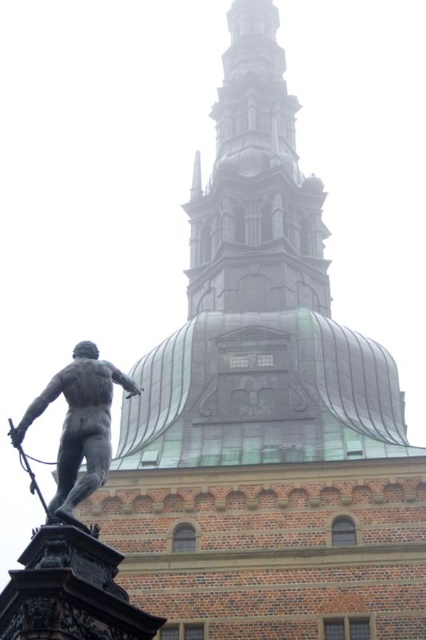
Question: Which point is farther to the camera?

Choices:
 (A) polished bronze statue at center
 (B) green copper dome at upper center

Answer: (B)

Question: Does green copper dome at upper center appear under polished bronze statue at center?

Choices:
 (A) yes
 (B) no

Answer: (B)

Question: Among these objects, which one is nearest to the camera?

Choices:
 (A) polished bronze statue at center
 (B) green copper dome at upper center

Answer: (A)

Question: Can you confirm if green copper dome at upper center is positioned above polished bronze statue at center?

Choices:
 (A) yes
 (B) no

Answer: (A)

Question: Does green copper dome at upper center have a greater width compared to polished bronze statue at center?

Choices:
 (A) no
 (B) yes

Answer: (B)